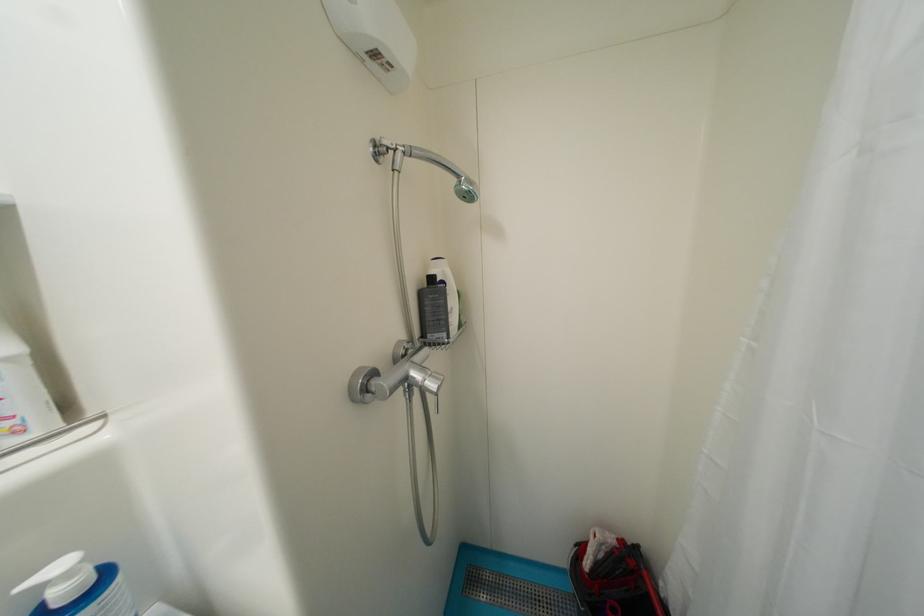
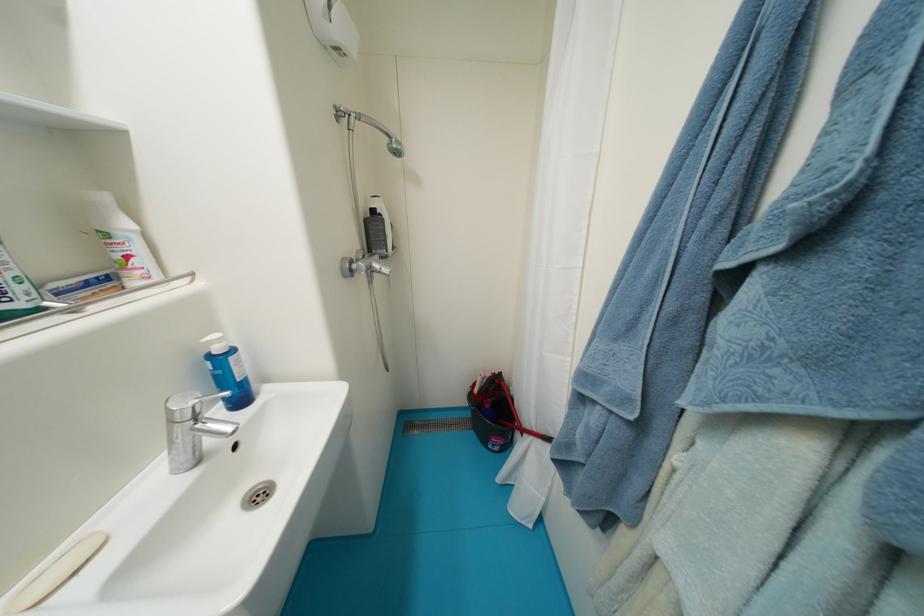
Find the pixel in the second image that matches (667,585) in the first image.

(517, 390)